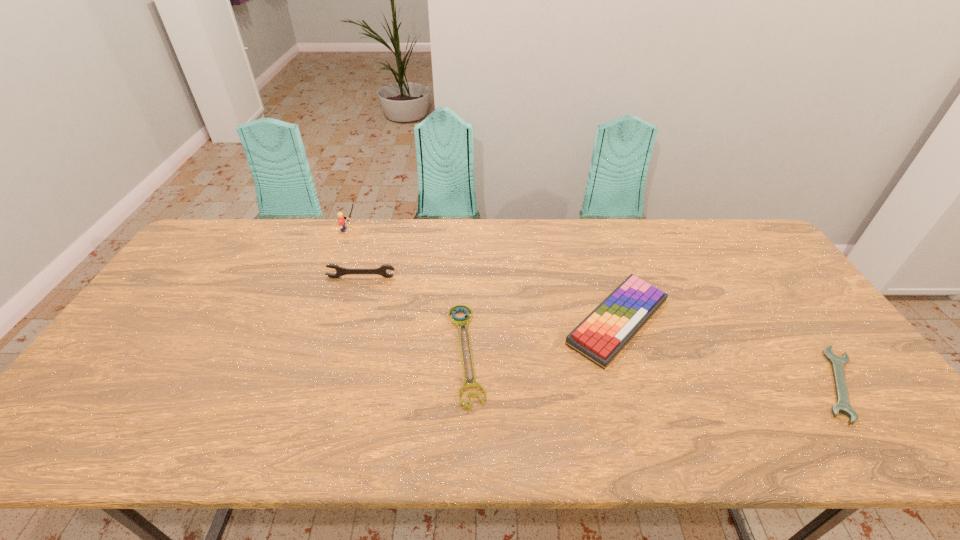
Identify the location of free space between the rightmost object and the second wrench from right to left. [653, 368].

The height and width of the screenshot is (540, 960). Find the location of `free point between the second wrench from left to right and the rightmost wrench`. free point between the second wrench from left to right and the rightmost wrench is located at coordinates (653, 368).

Locate which object ranks second in proximity to the second wrench from right to left. Please provide its 2D coordinates. Your answer should be formatted as a tuple, i.e. [(x, y)], where the tuple contains the x and y coordinates of a point satisfying the conditions above.

[(340, 271)]

I want to click on object that is the third closest one to the rightmost object, so click(x=340, y=271).

This screenshot has width=960, height=540. Find the location of `wrench that is the closest to the rightmost wrench`. wrench that is the closest to the rightmost wrench is located at coordinates (466, 319).

Identify which wrench is located as the nearest to the second wrench from right to left. Please provide its 2D coordinates. Your answer should be formatted as a tuple, i.e. [(x, y)], where the tuple contains the x and y coordinates of a point satisfying the conditions above.

[(340, 271)]

Locate an element on the screen. Image resolution: width=960 pixels, height=540 pixels. vacant space that satisfies the following two spatial constraints: 1. on the front-facing side of the farthest object; 2. on the back side of the computer keyboard is located at coordinates (316, 321).

Find the location of `vacant space that satisfies the following two spatial constraints: 1. on the open ends of the computer keyboard; 2. on the right side of the leftmost wrench`. vacant space that satisfies the following two spatial constraints: 1. on the open ends of the computer keyboard; 2. on the right side of the leftmost wrench is located at coordinates (348, 321).

Where is `vacant space that satisfies the following two spatial constraints: 1. on the open ends of the tallest wrench; 2. on the right side of the second wrench from left to right`? The image size is (960, 540). vacant space that satisfies the following two spatial constraints: 1. on the open ends of the tallest wrench; 2. on the right side of the second wrench from left to right is located at coordinates tap(339, 353).

Find the location of a particular element. vacant region that satisfies the following two spatial constraints: 1. on the front-facing side of the farthest object; 2. on the back side of the computer keyboard is located at coordinates (316, 321).